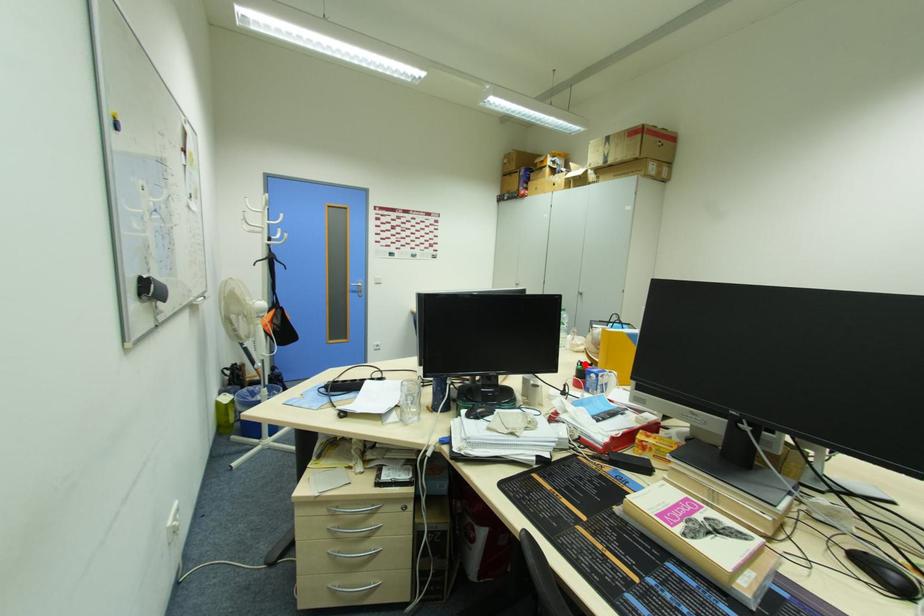
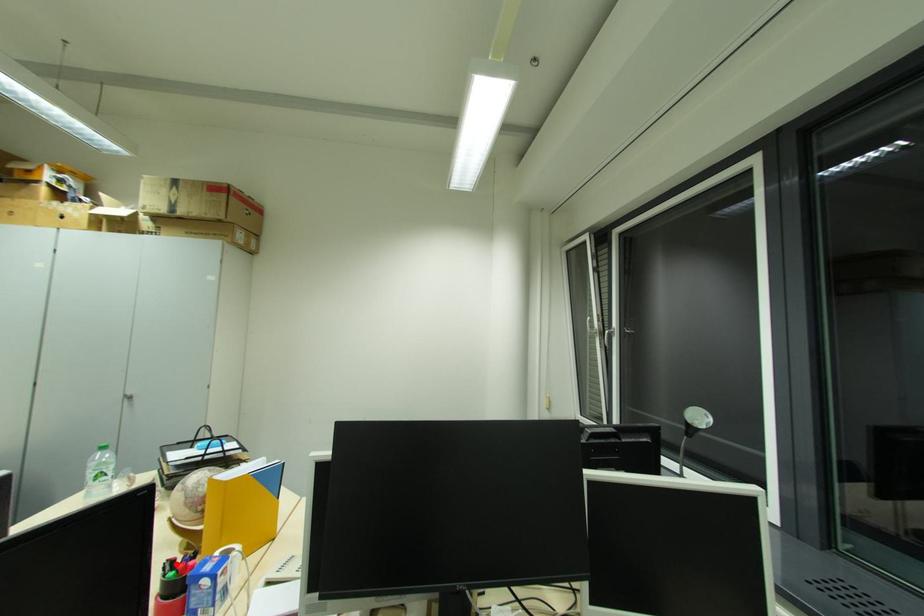
I am providing you with two images of the same scene from different viewpoints. A red point is marked on the first image and another point is marked on the second image. Is the red point in image1 aligned with the point shown in image2?

Yes